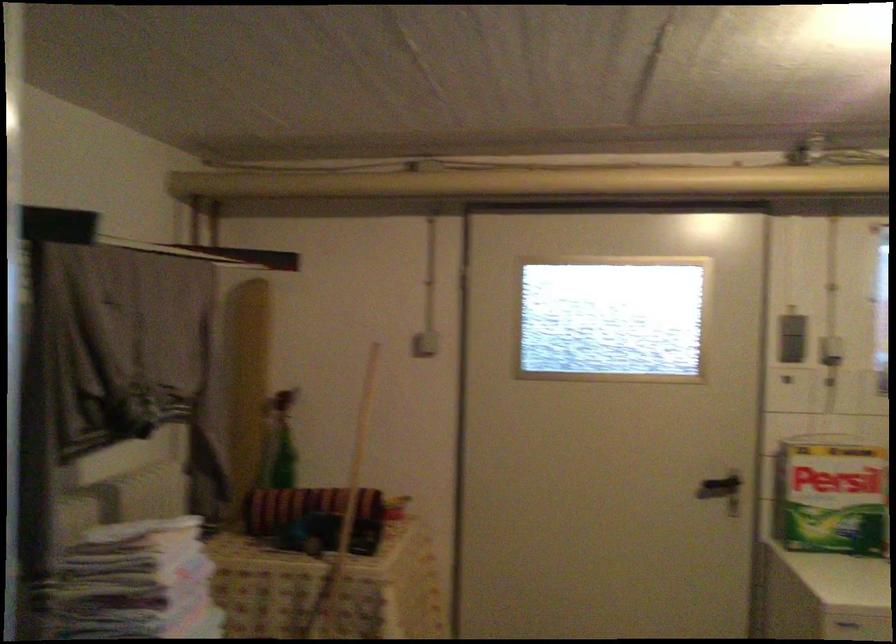
The width and height of the screenshot is (896, 644). Identify the location of gray wall switch. (791, 337).